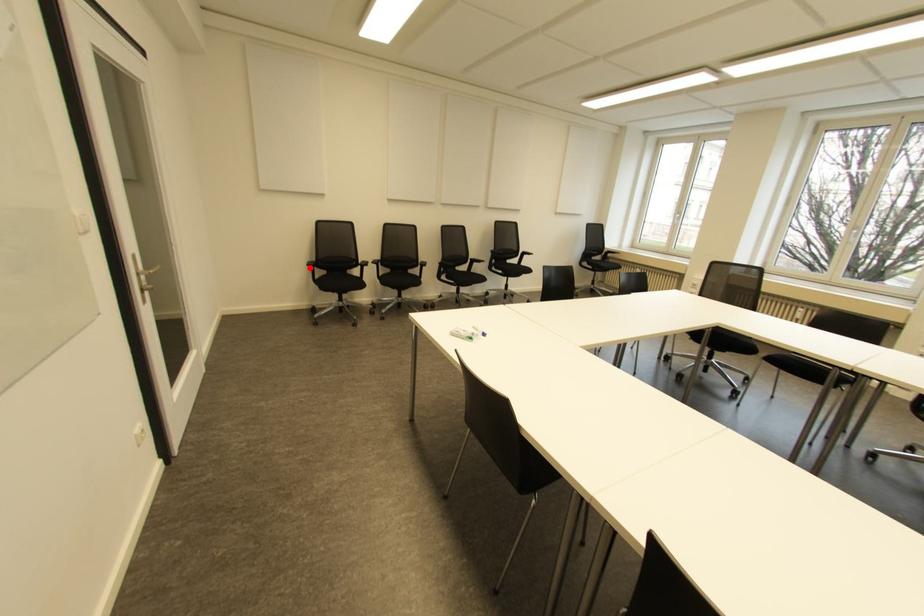
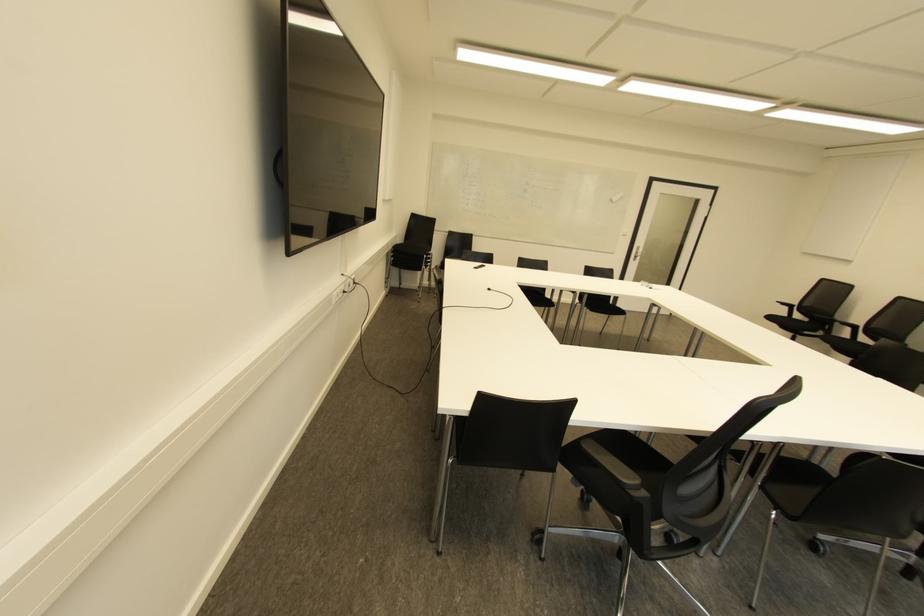
Locate, in the second image, the point that corresponds to the highlighted location in the first image.

(785, 307)